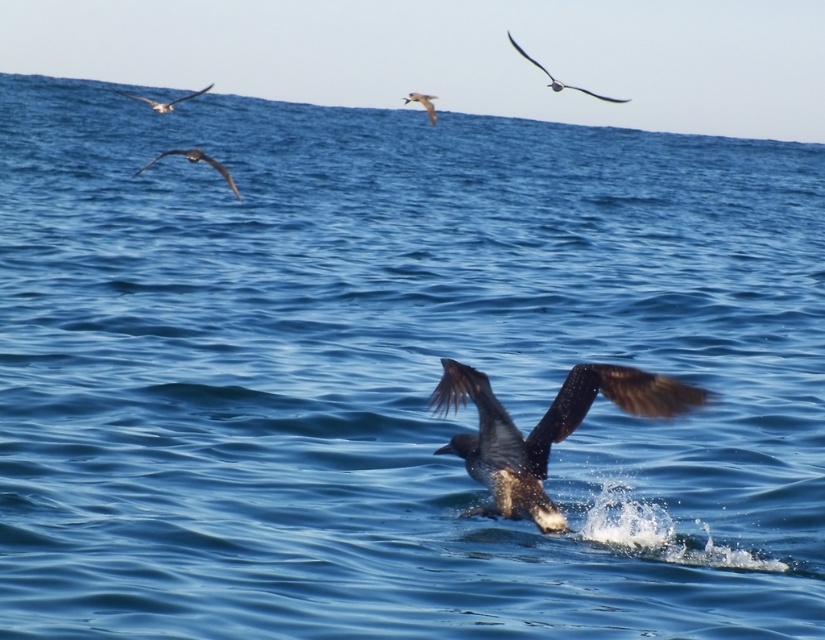
Does point (192, 163) come behind point (432, 113)?

No, it is not.

Which of these two, dark brown feathers at upper left or white glossy seagull at upper center, stands shorter?

white glossy seagull at upper center is shorter.

Describe the element at coordinates (194, 163) in the screenshot. I see `dark brown feathers at upper left` at that location.

This screenshot has width=825, height=640. Find the location of `dark brown feathers at upper left`. dark brown feathers at upper left is located at coordinates (194, 163).

Is brown feathered bird at center to the left of dark brown feathers at upper left from the viewer's perspective?

In fact, brown feathered bird at center is to the right of dark brown feathers at upper left.

Is brown feathered bird at center wider than dark brown feathers at upper left?

In fact, brown feathered bird at center might be narrower than dark brown feathers at upper left.

Between point (653, 406) and point (138, 172), which one is positioned in front?

Point (653, 406) is more forward.

Locate an element on the screen. This screenshot has height=640, width=825. brown feathered bird at center is located at coordinates (543, 429).

Between dark brown feathers at upper left and shiny silver bird at upper left, which one is positioned lower?

Positioned lower is dark brown feathers at upper left.

Is point (222, 173) farther from viewer compared to point (208, 84)?

That is False.

Identify the location of dark brown feathers at upper left. (194, 163).